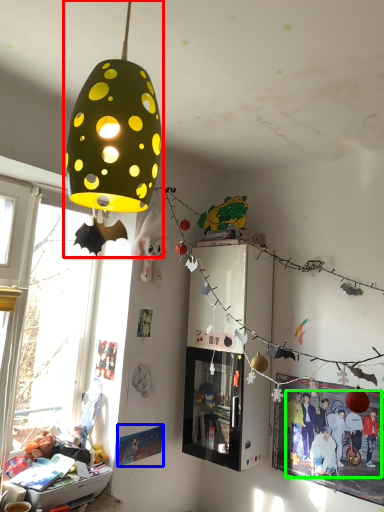
Question: Which object is positioned farthest from lamp (highlighted by a red box)? Select from poster page (highlighted by a blue box) and person (highlighted by a green box).

Choices:
 (A) poster page
 (B) person

Answer: (B)